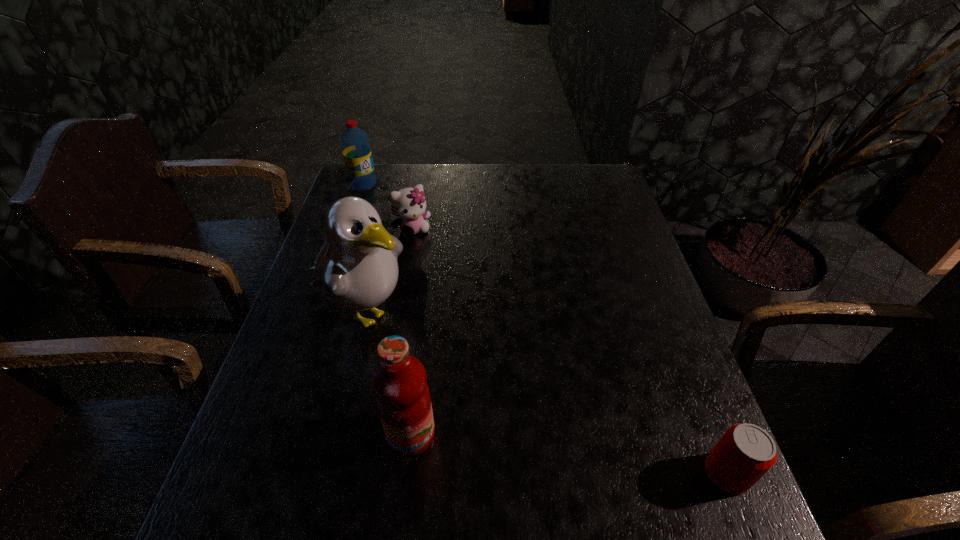
Locate an element on the screen. The height and width of the screenshot is (540, 960). fruit juice is located at coordinates (399, 381).

Locate an element on the screen. This screenshot has width=960, height=540. the rightmost object is located at coordinates (745, 452).

The width and height of the screenshot is (960, 540). I want to click on the shortest object, so click(745, 452).

At what (x,y) coordinates should I click in order to perform the action: click on the tallest object. Please return your answer as a coordinate pair (x, y). This screenshot has width=960, height=540. Looking at the image, I should click on (356, 269).

At what (x,y) coordinates should I click in order to perform the action: click on gull. Please return your answer as a coordinate pair (x, y). Looking at the image, I should click on (356, 269).

This screenshot has height=540, width=960. What are the coordinates of `the second shortest object` in the screenshot? It's located at [x=409, y=204].

Locate an element on the screen. This screenshot has height=540, width=960. kitten is located at coordinates (409, 204).

At what (x,y) coordinates should I click in order to perform the action: click on water bottle. Please return your answer as a coordinate pair (x, y). Image resolution: width=960 pixels, height=540 pixels. Looking at the image, I should click on (355, 144).

Image resolution: width=960 pixels, height=540 pixels. Identify the location of the farthest object. (355, 144).

You are a GUI agent. You are given a task and a screenshot of the screen. Output one action in this format:
    pyautogui.click(x=<x>, y=<y>)
    Task: Click on the free location located on the back of the rightmost object
    This screenshot has width=960, height=540.
    Given the screenshot: What is the action you would take?
    pyautogui.click(x=678, y=350)